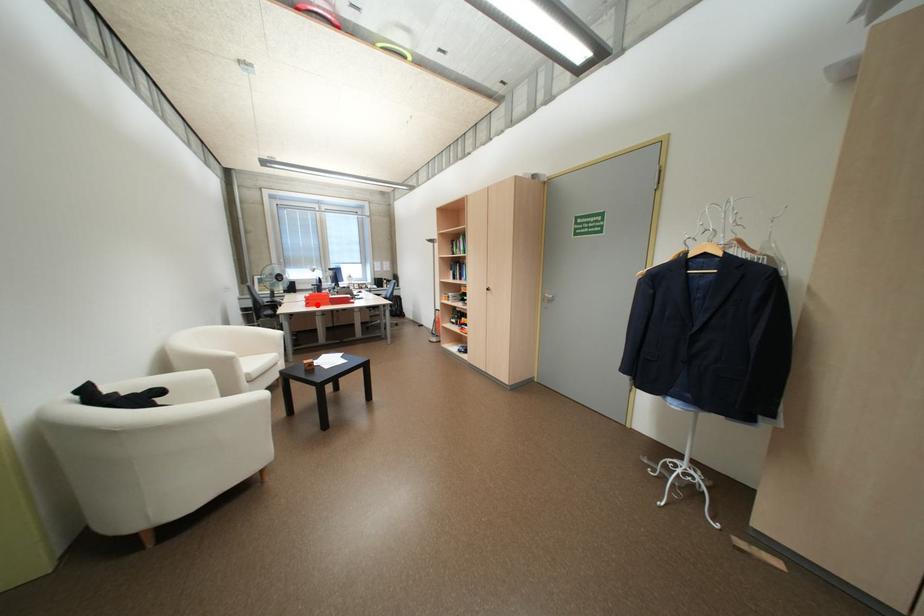
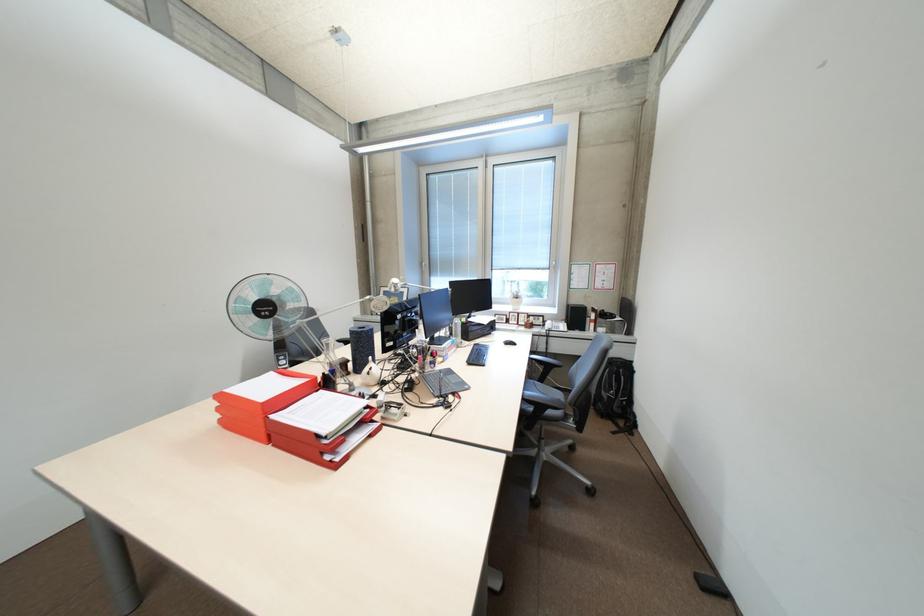
Question: I am providing you with two images of the same scene from different viewpoints. A red point is shown in image1. For the corresponding object point in image2, is it positioned nearer or farther from the camera?

Choices:
 (A) Nearer
 (B) Farther

Answer: (B)